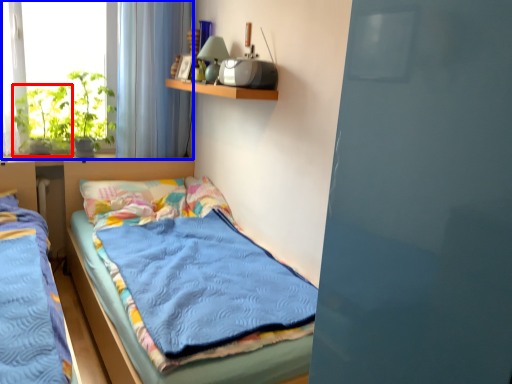
Question: Among these objects, which one is farthest to the camera, plant (highlighted by a red box) or window (highlighted by a blue box)?

Choices:
 (A) plant
 (B) window

Answer: (A)